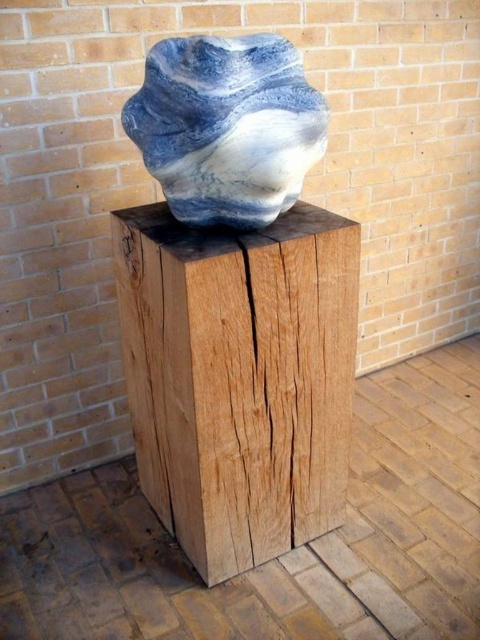
Between natural wood block at center and marble-like stone at center, which one appears on the left side from the viewer's perspective?

natural wood block at center is more to the left.

Can you confirm if natural wood block at center is positioned above marble-like stone at center?

No.

Find the location of `natural wood block at center`. natural wood block at center is located at coordinates (239, 378).